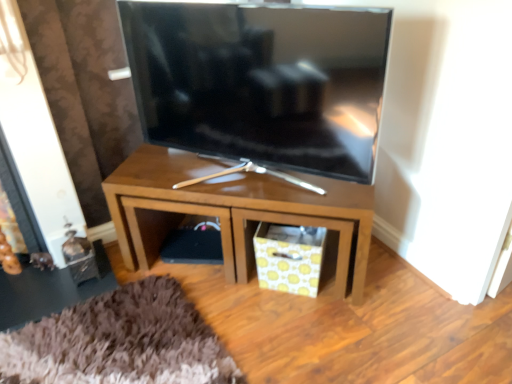
This screenshot has height=384, width=512. What are the coordinates of `vacant point above shiny metallic side table at lower left (from a real-world perspective)` in the screenshot? It's located at (45, 282).